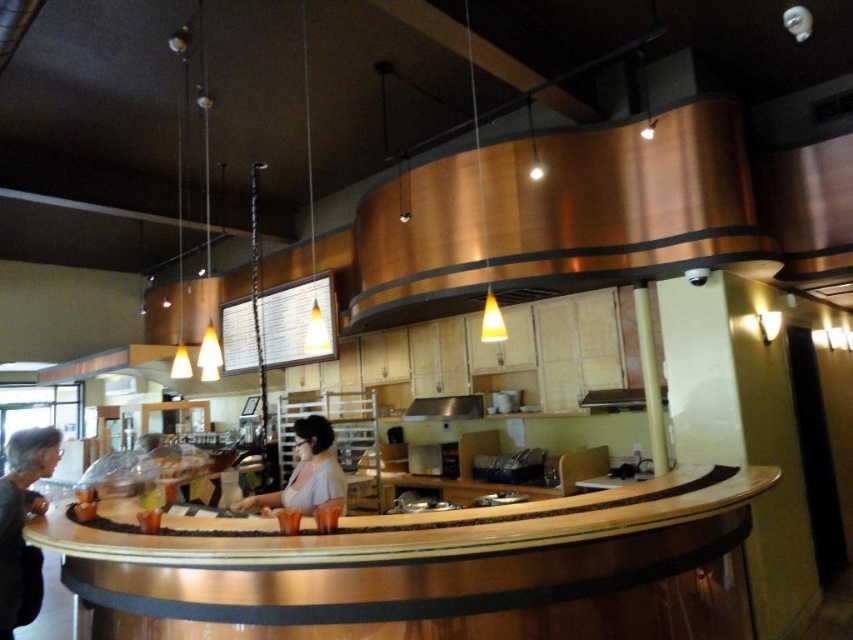
Question: Is wooden counter at center to the right of light beige fabric shirt at center from the viewer's perspective?

Choices:
 (A) no
 (B) yes

Answer: (B)

Question: Where is wooden counter at center located in relation to light beige fabric shirt at center in the image?

Choices:
 (A) left
 (B) right

Answer: (B)

Question: Can you confirm if wooden counter at center is wider than light beige fabric shirt at center?

Choices:
 (A) no
 (B) yes

Answer: (B)

Question: Which point is closer to the camera?

Choices:
 (A) (456, 509)
 (B) (294, 476)

Answer: (A)